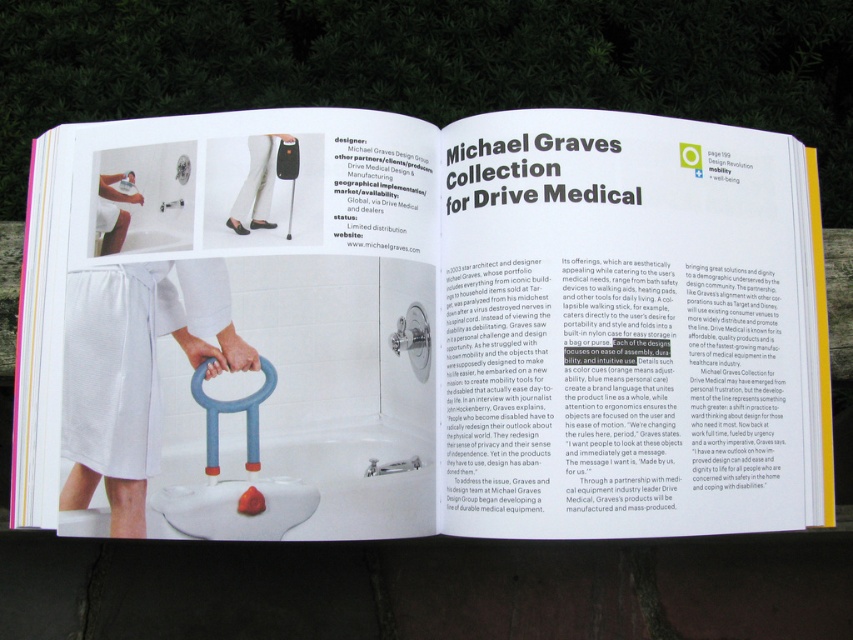
What is located at the coordinates point (132,371) on the left page of the magazine spread?

The point (132,371) marks the white textured towel at lower left.

You are standing 5 feet away from the magazine spread. Can you see the point at coordinates point (482, 161) clearly?

The distance of point (482, 161) from viewer is 4.80 feet, so yes, you can see it clearly since you are standing 5 feet away, which is slightly farther than the point itself.

Based on the magazine spread, can you determine if the point at coordinates (84, 452) is closer to the viewer than the point at (271, 378)?

No, the point at coordinates (84, 452) is behind the point at (271, 378), so it is farther from the viewer.